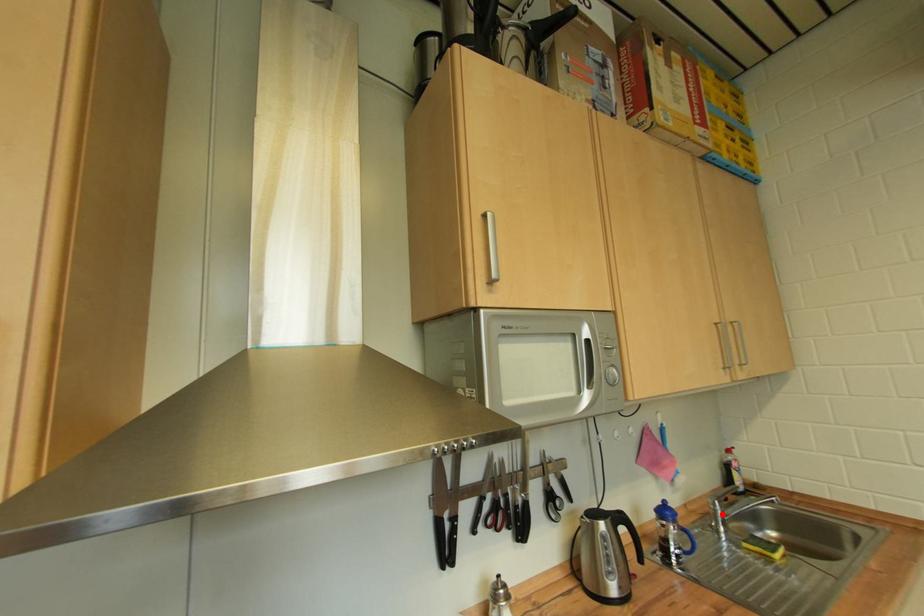
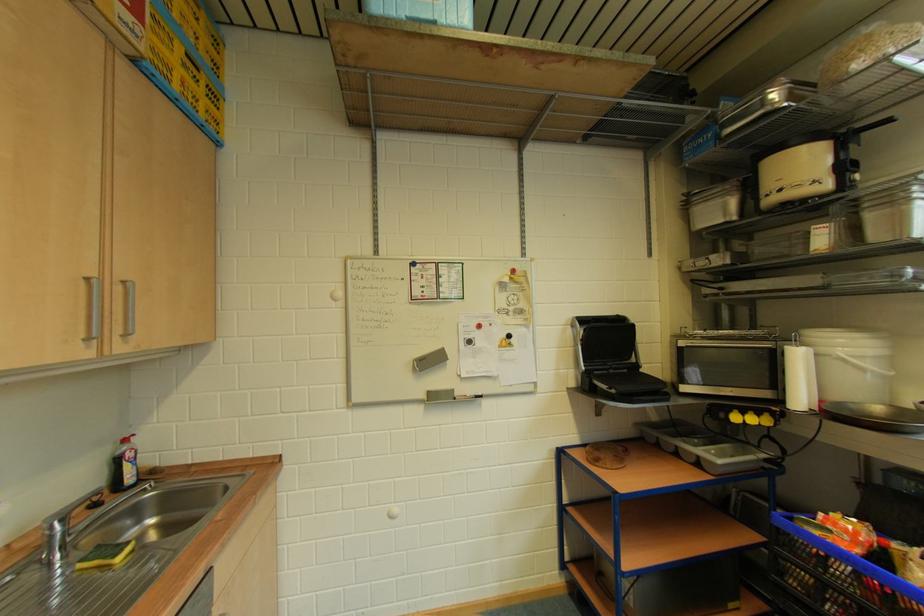
The point at the highlighted location is marked in the first image. Where is the corresponding point in the second image?

(61, 539)